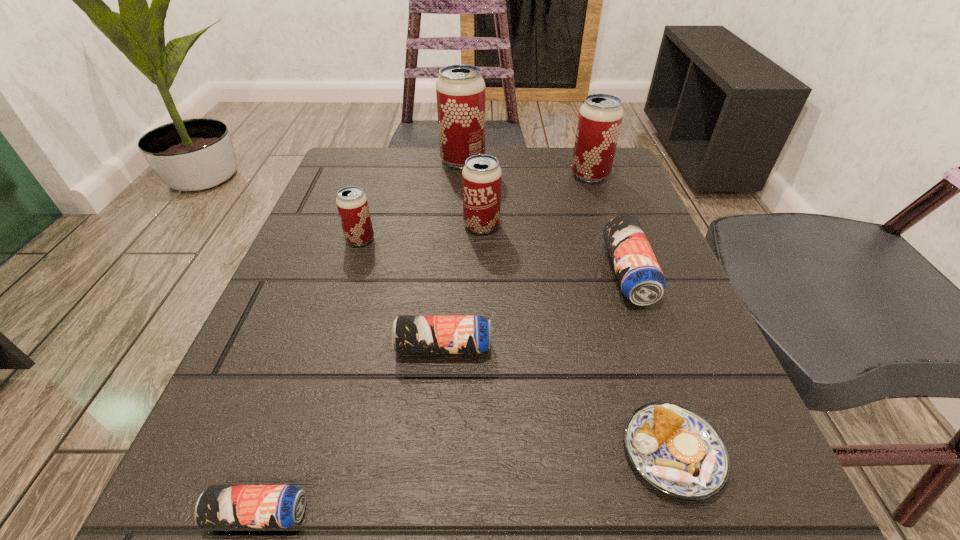
Locate an element on the screen. The height and width of the screenshot is (540, 960). vacant space at the left edge is located at coordinates (284, 393).

The width and height of the screenshot is (960, 540). What are the coordinates of `vacant area at the right edge` in the screenshot? It's located at (618, 329).

Locate an element on the screen. The image size is (960, 540). vacant space at the far left corner of the desktop is located at coordinates (328, 194).

I want to click on vacant space at the near left corner, so click(175, 509).

Identify the location of free space at the far right corner of the desktop. pyautogui.click(x=551, y=157).

You are a GUI agent. You are given a task and a screenshot of the screen. Output one action in this format:
    pyautogui.click(x=<x>, y=<y>)
    Task: Click on the vacant space at the near right corner of the desktop
    Image resolution: width=960 pixels, height=540 pixels.
    Given the screenshot: What is the action you would take?
    pyautogui.click(x=652, y=504)

Identify the location of vacant point located between the shortest beer can and the third tallest object. The image size is (960, 540). (370, 369).

The height and width of the screenshot is (540, 960). I want to click on vacant space that is in between the fifth tallest beer can and the sixth farthest object, so click(x=536, y=310).

I want to click on unoccupied position between the second tallest object and the second smallest red beer can, so click(x=536, y=200).

I want to click on free space between the fourth tallest beer can and the pastry, so pyautogui.click(x=516, y=346).